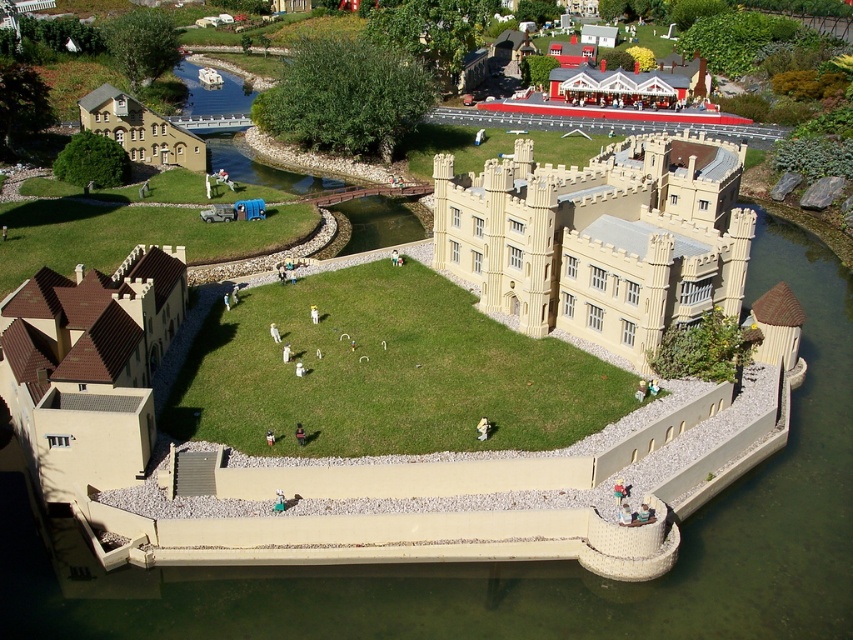
Question: Is brown tiled roof at lower left smaller than beige stone building at upper left?

Choices:
 (A) yes
 (B) no

Answer: (B)

Question: Which point appears closest to the camera in this image?

Choices:
 (A) coord(22,288)
 (B) coord(610,189)

Answer: (A)

Question: Which object appears farthest from the camera in this image?

Choices:
 (A) beige stone castle at center
 (B) beige stone building at upper left

Answer: (B)

Question: Which of these objects is positioned closest to the beige stone castle at center?

Choices:
 (A) beige stone building at upper left
 (B) brown tiled roof at lower left

Answer: (B)

Question: Can you confirm if beige stone castle at center is positioned below brown tiled roof at lower left?

Choices:
 (A) no
 (B) yes

Answer: (A)

Question: Does beige stone castle at center have a larger size compared to beige stone building at upper left?

Choices:
 (A) yes
 (B) no

Answer: (A)